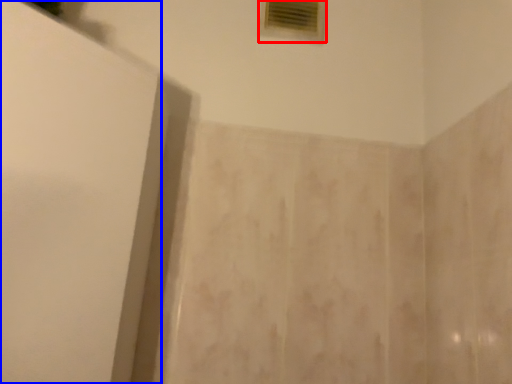
Question: Which of the following is the farthest to the observer, window (highlighted by a red box) or screen door (highlighted by a blue box)?

Choices:
 (A) window
 (B) screen door

Answer: (A)